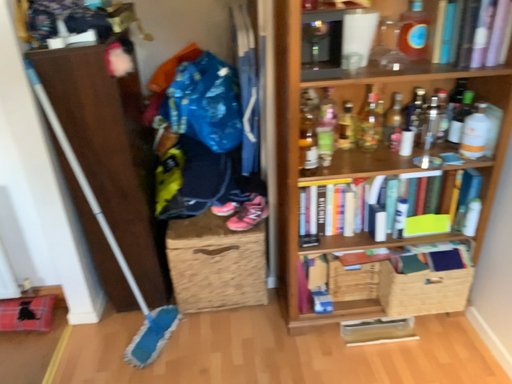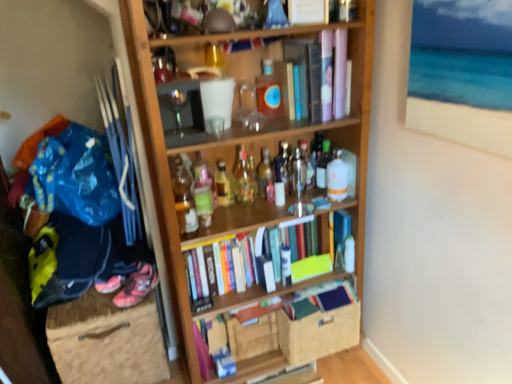
Question: Which way did the camera rotate in the video?

Choices:
 (A) rotated right
 (B) rotated left

Answer: (A)